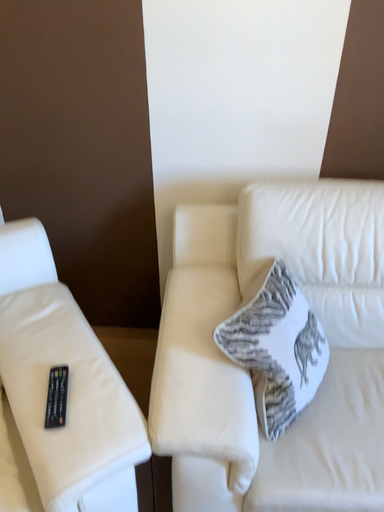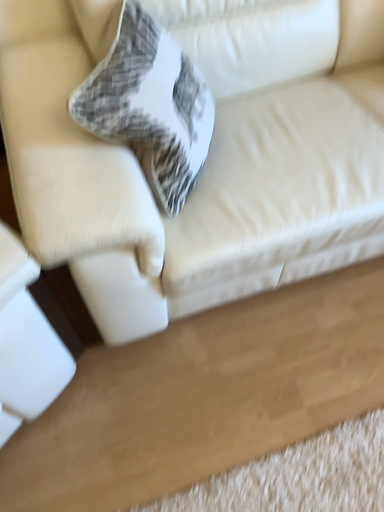
Question: How did the camera likely rotate when shooting the video?

Choices:
 (A) rotated upward
 (B) rotated downward

Answer: (B)